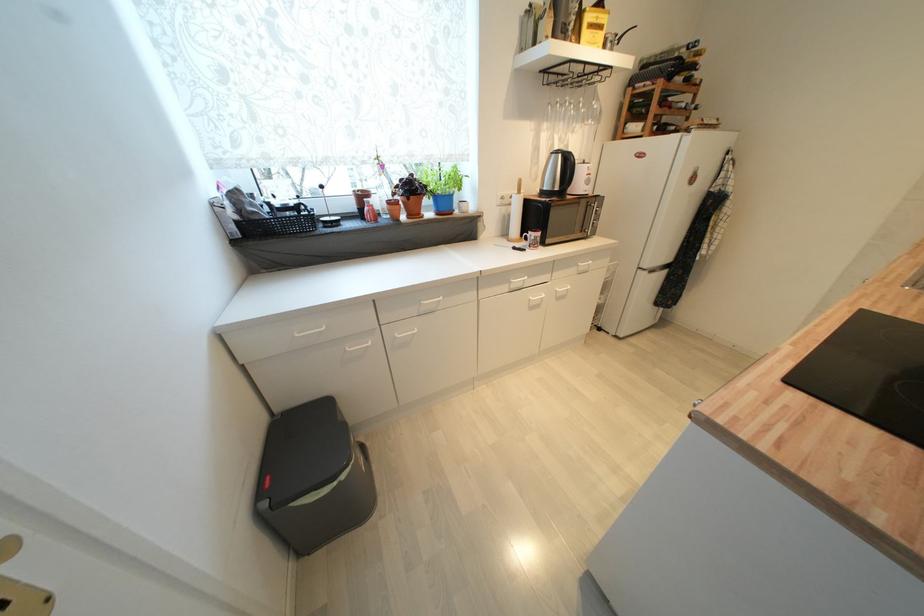
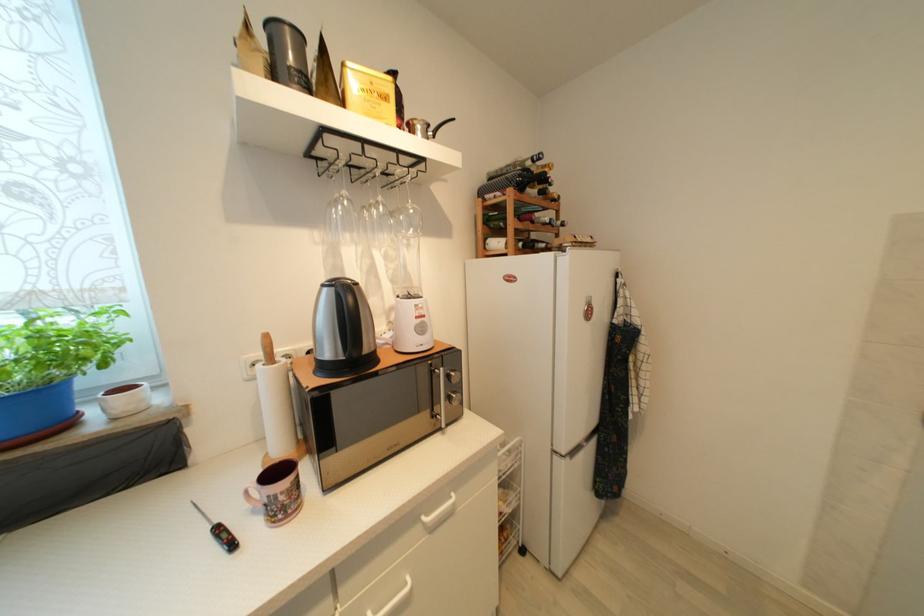
In the second image, find the point that corresponds to (681,79) in the first image.

(533, 192)